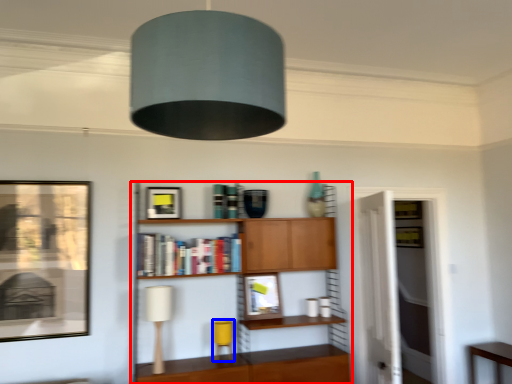
Question: Which point is further to the camera, shelf (highlighted by a red box) or table lamp (highlighted by a blue box)?

Choices:
 (A) shelf
 (B) table lamp

Answer: (B)